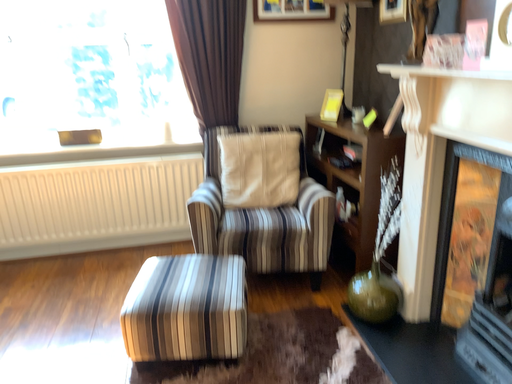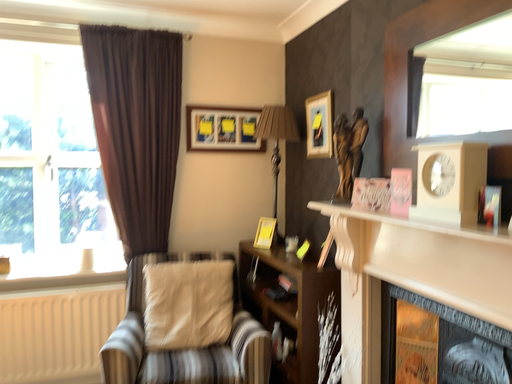
Question: How did the camera likely rotate when shooting the video?

Choices:
 (A) rotated left
 (B) rotated right

Answer: (B)